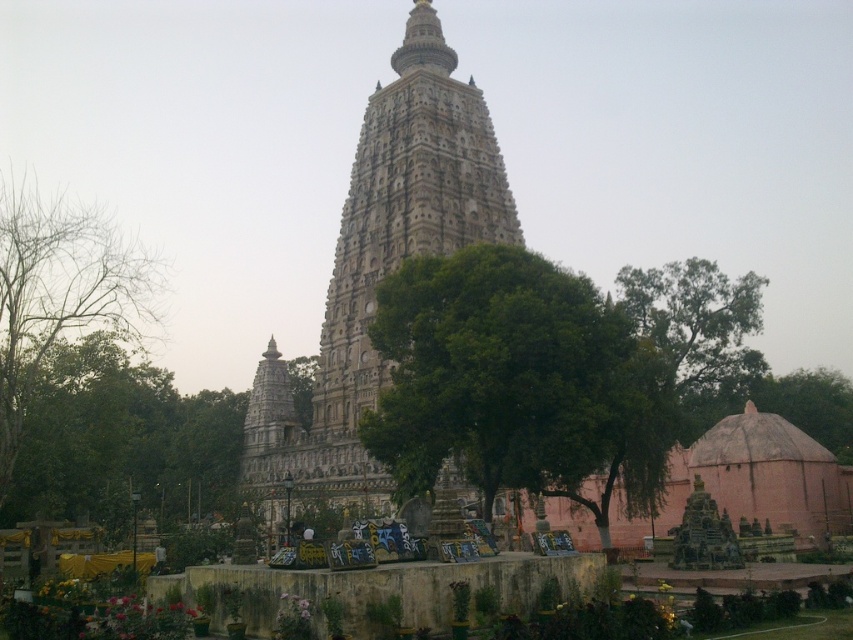
You are a drone operator tasked with capturing aerial footage of the Mahabodhi Temple. Your drone is currently positioned above the bare branches at left. You need to fly it to the brown textured dome at lower right. Given that your drone has a maximum flight range of 70 meters before needing to return, will you be able to reach the dome without needing to recharge?

The distance between the bare branches at left and the brown textured dome at lower right is 72.32 meters. Since the drone can only fly 70 meters before needing to return, it cannot reach the dome without recharging.

You are a visitor standing in front of the Mahabodhi Temple. You notice a green leafy tree at center and a bare branches at left. Which tree has a greater height?

The bare branches at left are taller than the green leafy tree at center.

You are a visitor at the Mahabodhi Temple and want to take a photo of the stupa. You notice two green leafy trees in the foreground. Which tree, the green leafy tree at center or the green leafy tree at left, would block less of the stupa in your photo?

The green leafy tree at left would block less of the stupa in your photo because it is shorter than the green leafy tree at center.